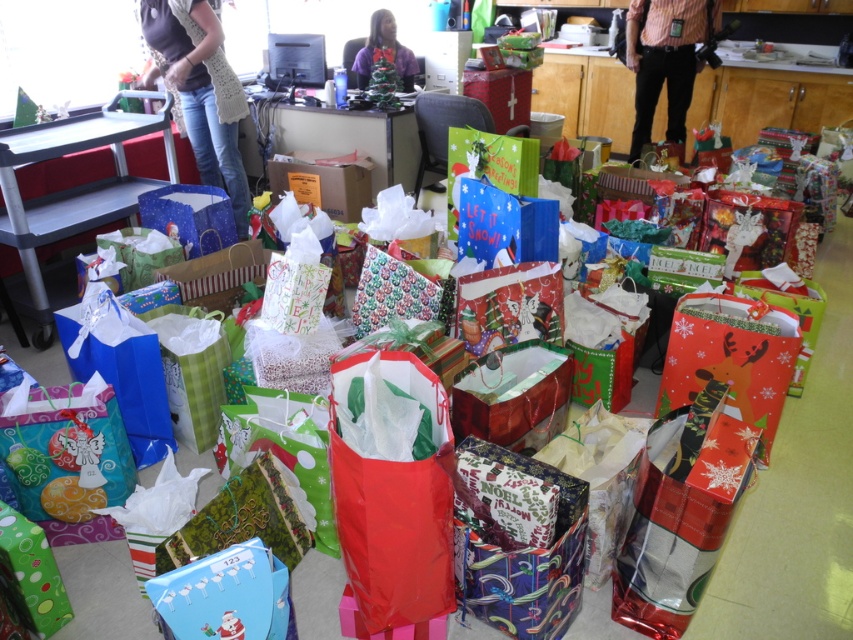
Question: Is denim jeans at left to the left of purple fleece sweater at center from the viewer's perspective?

Choices:
 (A) no
 (B) yes

Answer: (B)

Question: Does striped shirt at upper right come in front of cardboard box at center?

Choices:
 (A) no
 (B) yes

Answer: (A)

Question: Which of the following is the farthest from the observer?

Choices:
 (A) purple fleece sweater at center
 (B) striped shirt at upper right
 (C) denim jeans at left

Answer: (B)

Question: Among these objects, which one is nearest to the camera?

Choices:
 (A) denim jeans at left
 (B) cardboard box at center

Answer: (A)

Question: Does denim jeans at left appear over cardboard box at center?

Choices:
 (A) yes
 (B) no

Answer: (A)

Question: Estimate the real-world distances between objects in this image. Which object is farther from the cardboard box at center?

Choices:
 (A) denim jeans at left
 (B) striped shirt at upper right

Answer: (B)